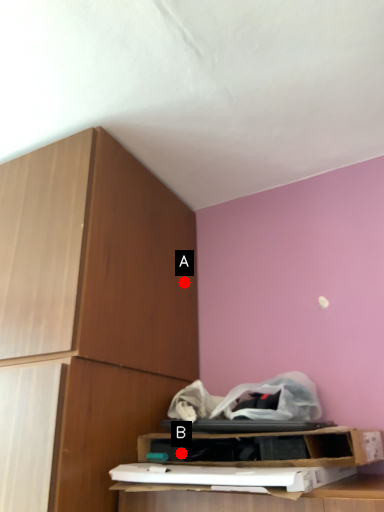
Question: Two points are circled on the image, labeled by A and B beside each circle. Which point is farther from the camera taking this photo?

Choices:
 (A) A is further
 (B) B is further

Answer: (A)